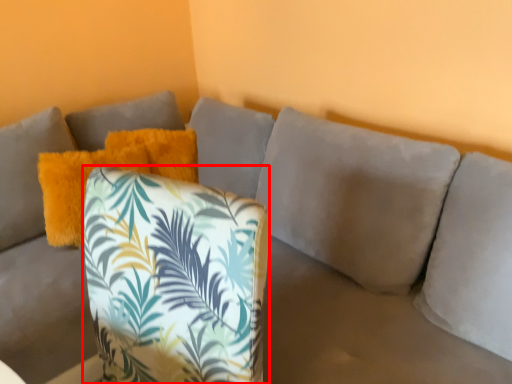
Question: From the image's perspective, considering the relative positions of throw pillow (annotated by the red box) and pillow in the image provided, where is throw pillow (annotated by the red box) located with respect to the staircase?

Choices:
 (A) below
 (B) above

Answer: (A)